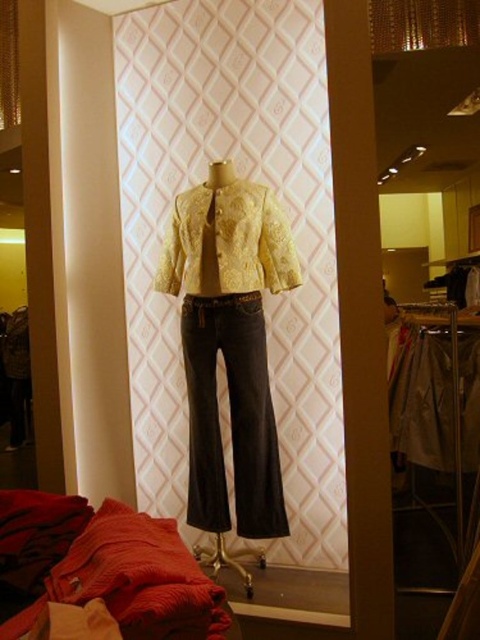
Question: Among these points, which one is nearest to the camera?

Choices:
 (A) (223, 458)
 (B) (435, 364)

Answer: (A)

Question: Does dark gray denim jeans at center appear on the right side of white cotton shirt at center?

Choices:
 (A) no
 (B) yes

Answer: (A)

Question: Does dark gray denim jeans at center have a greater width compared to white cotton shirt at center?

Choices:
 (A) no
 (B) yes

Answer: (B)

Question: Which point is farther to the camera?

Choices:
 (A) (479, 374)
 (B) (205, 385)

Answer: (A)

Question: Can you confirm if dark gray denim jeans at center is wider than white cotton shirt at center?

Choices:
 (A) no
 (B) yes

Answer: (B)